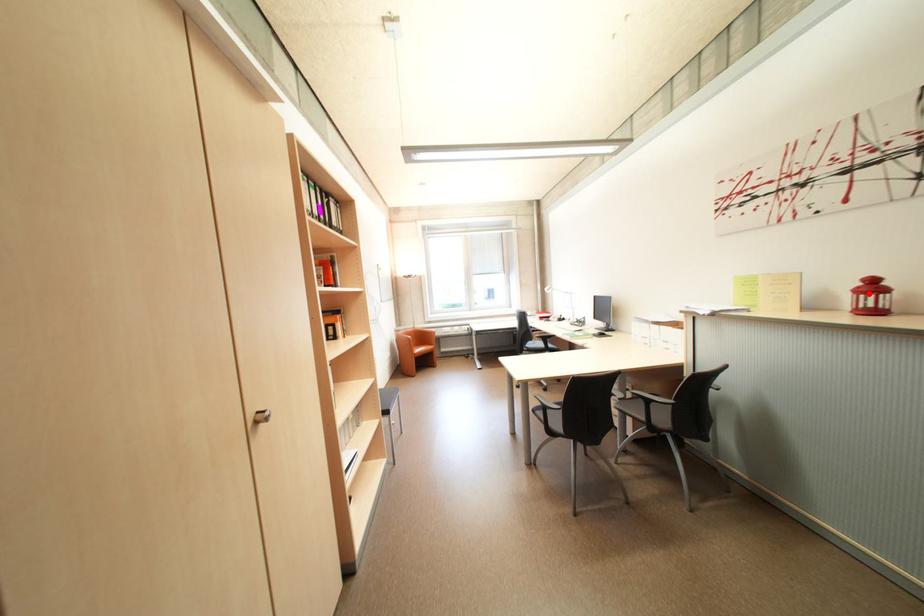
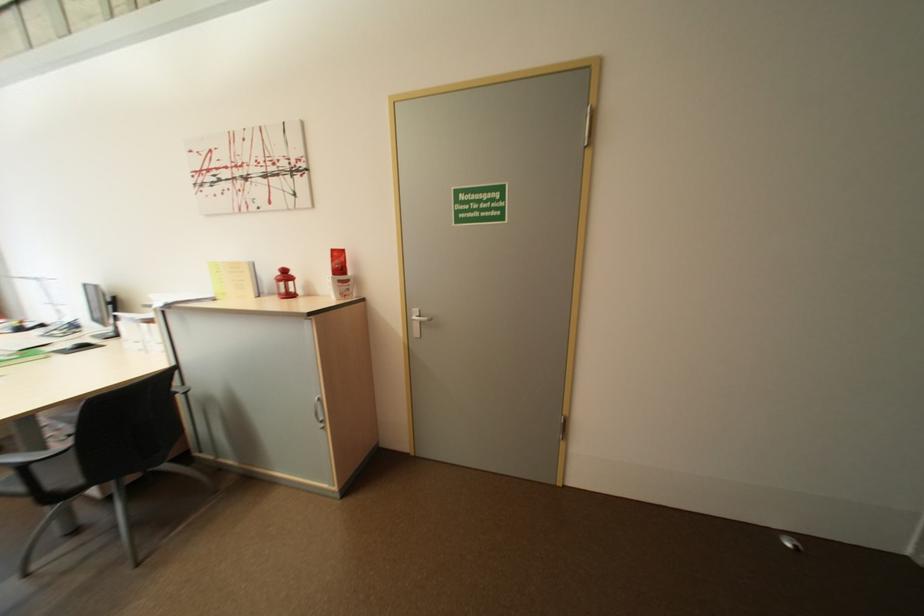
In the second image, find the point that corresponds to the highlighted location in the first image.

(286, 282)